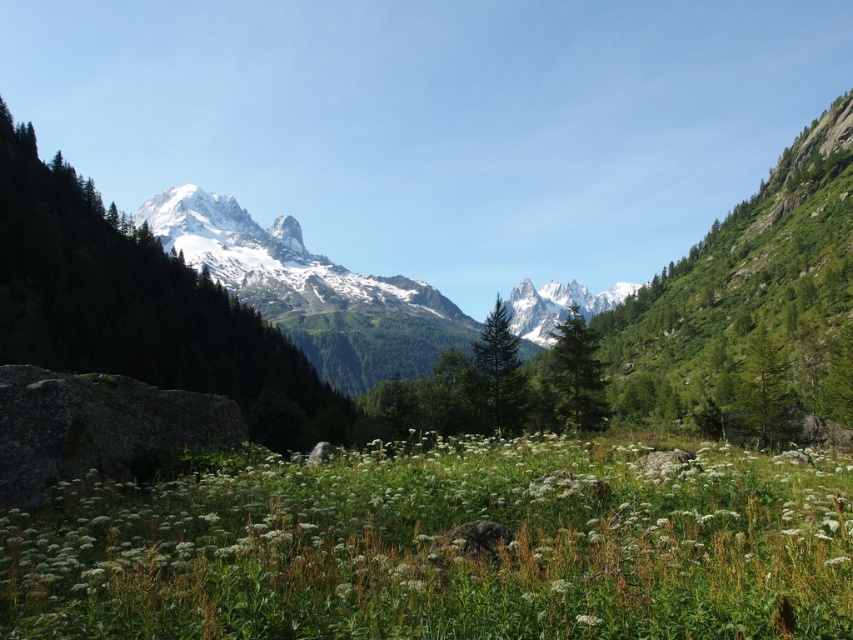
You are standing at the origin point of the coordinate system in the image. You want to locate the green leafy plant at center. What are its coordinates?

The green leafy plant at center is located at coordinates point (444,545).

You are standing in the meadow and want to take a photo of both the point at coordinates (538,609) and the point at coordinates (192,266). Which point will appear larger in your photo?

Point at coordinates (538,609) will appear larger in the photo because it is closer to the camera than point at coordinates (192,266).